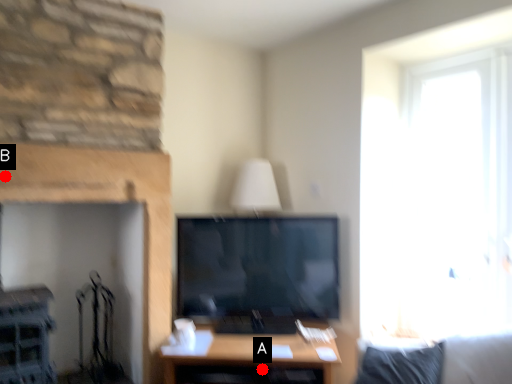
Question: Two points are circled on the image, labeled by A and B beside each circle. Which point is farther from the camera taking this photo?

Choices:
 (A) A is further
 (B) B is further

Answer: (A)